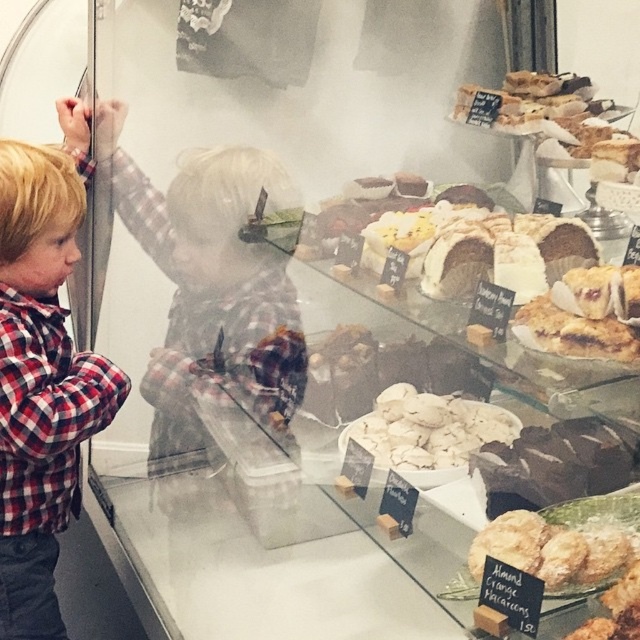
You are a customer in a bakery and see the plaid shirt at left and the golden flaky pie at center. Which item is taller?

The plaid shirt at left is much taller than the golden flaky pie at center.